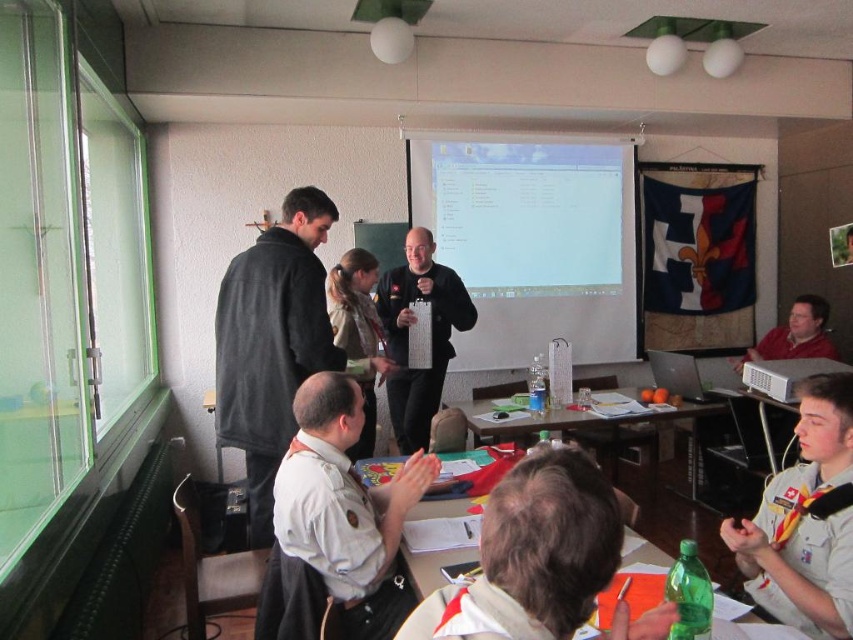
Is black matte jacket at center further to camera compared to matte plastic table at center?

Yes, it is.

Measure the distance between black matte jacket at center and matte plastic table at center.

They are 9.67 feet apart.

Find the location of a particular element. black matte jacket at center is located at coordinates coord(431,336).

This screenshot has width=853, height=640. In order to click on light brown uniform at center in this screenshot , I will do `click(345, 508)`.

Is point (378, 588) positioned before point (762, 496)?

Yes, point (378, 588) is in front of point (762, 496).

This screenshot has width=853, height=640. Identify the location of light brown uniform at center. (345, 508).

Based on the photo, which is above, matte plastic table at center or wooden table at center?

Positioned higher is matte plastic table at center.

Between matte plastic table at center and wooden table at center, which one has more height?

With more height is wooden table at center.

I want to click on matte plastic table at center, so click(x=561, y=538).